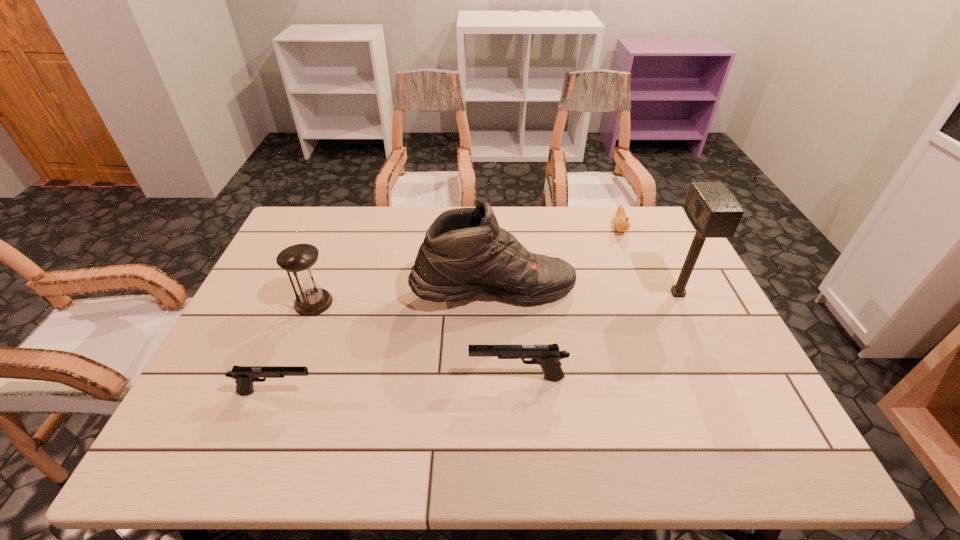
This screenshot has width=960, height=540. Identify the location of the fifth closest object relative to the third tallest object. (713, 211).

In order to click on free space that satisfies the following two spatial constraints: 1. on the front side of the hourglass; 2. at the aiming end of the left gun in this screenshot , I will do `click(278, 392)`.

In order to click on vacant area in the image that satisfies the following two spatial constraints: 1. on the front side of the ski boot; 2. at the aiming end of the shorter gun in this screenshot , I will do `click(497, 392)`.

This screenshot has height=540, width=960. I want to click on free space that satisfies the following two spatial constraints: 1. on the back side of the rightmost object; 2. on the left side of the fourth shortest object, so click(x=317, y=294).

Identify the location of vacant space that satisfies the following two spatial constraints: 1. on the front side of the hourglass; 2. at the aiming end of the nearest object. (278, 392).